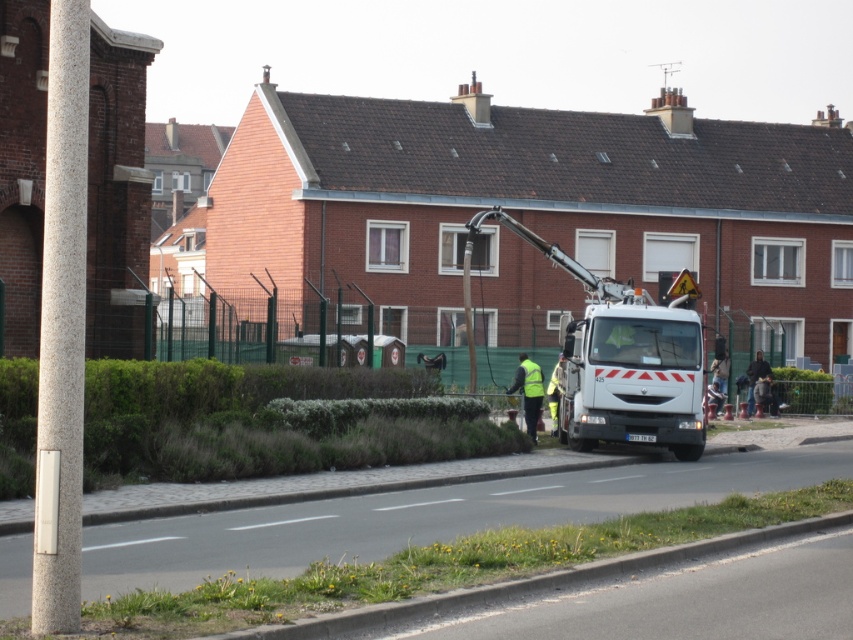
You are a delivery driver who needs to park your vehicle in a spot that is not occupied by the white glossy truck at center. Based on the scene, where should you avoid parking?

You should avoid parking at the location marked by coordinates point (624, 356) where the white glossy truck at center is currently parked.

You are a pedestrian standing on the sidewalk and see the high visibility yellow vest at center and the yellow reflective safety vest at center. Which one is taller?

The high visibility yellow vest at center is much taller than the yellow reflective safety vest at center.

You are a pedestrian standing on the sidewalk and see the white glossy truck at center and the yellow reflective safety vest at center. Which object is closer to you?

The white glossy truck at center is closer to you because it is in front of the yellow reflective safety vest at center.